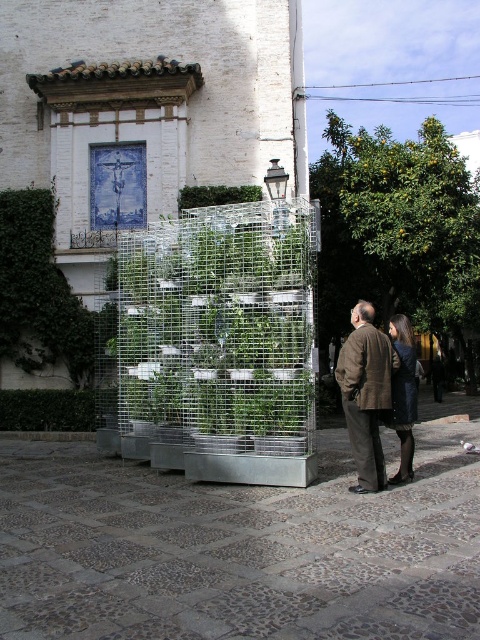
Is clear wire mesh at center closer to the viewer compared to green leafy hedge at right?

Result: Yes, clear wire mesh at center is in front of green leafy hedge at right.

Between clear wire mesh at center and green leafy hedge at right, which one appears on the left side from the viewer's perspective?

From the viewer's perspective, clear wire mesh at center appears more on the left side.

At what (x,y) coordinates should I click in order to perform the action: click on clear wire mesh at center. Please return your answer as a coordinate pair (x, y). The image size is (480, 640). Looking at the image, I should click on (216, 346).

Does green leafy hedge at right have a lesser width compared to green ivy hedge at upper left?

Incorrect, green leafy hedge at right's width is not less than green ivy hedge at upper left's.

At what (x,y) coordinates should I click in order to perform the action: click on green leafy hedge at right. Please return your answer as a coordinate pair (x, y). Looking at the image, I should click on (397, 228).

Where is `green leafy hedge at right`? The image size is (480, 640). green leafy hedge at right is located at coordinates (397, 228).

Is clear wire mesh at center wider than green leafy hedge at lower left?

Yes.

Is point (256, 209) positioned behind point (21, 426)?

No, it is not.

Where is `clear wire mesh at center`? clear wire mesh at center is located at coordinates (216, 346).